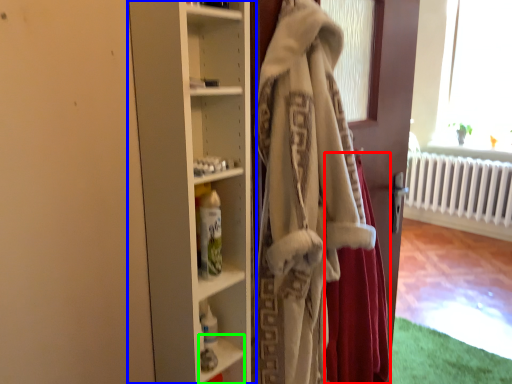
Question: Which is farther away from shawl (highlighted by a red box)? cupboard (highlighted by a blue box) or shelf (highlighted by a green box)?

Choices:
 (A) cupboard
 (B) shelf

Answer: (A)